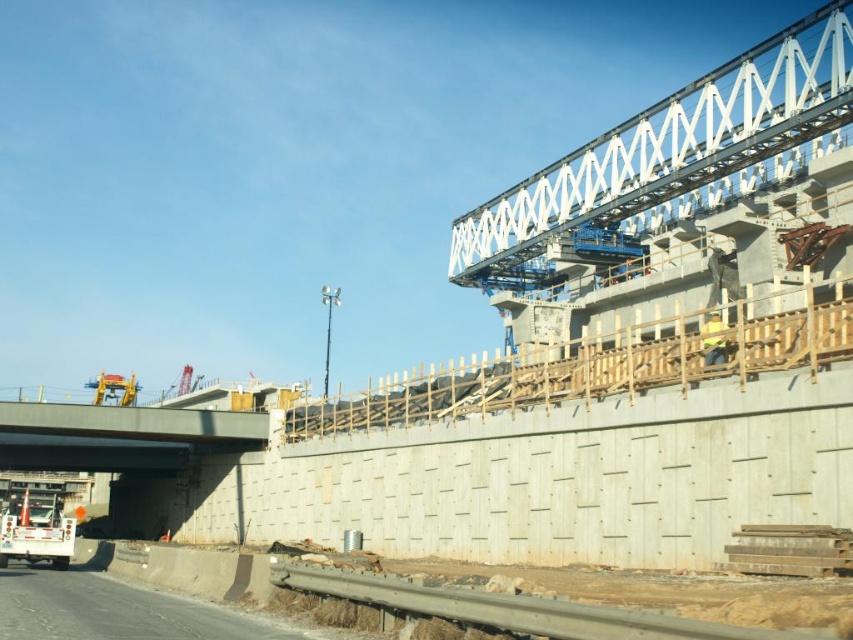
Does gray metallic overpass at left have a larger size compared to yellow reflective vest at center?

Correct, gray metallic overpass at left is larger in size than yellow reflective vest at center.

Find the location of `gray metallic overpass at left`. gray metallic overpass at left is located at coordinates (119, 435).

The width and height of the screenshot is (853, 640). Describe the element at coordinates (119, 435) in the screenshot. I see `gray metallic overpass at left` at that location.

What are the coordinates of `gray metallic overpass at left` in the screenshot? It's located at (119, 435).

Is gray metallic overpass at left thinner than gray concrete highway at lower left?

No, gray metallic overpass at left is not thinner than gray concrete highway at lower left.

The height and width of the screenshot is (640, 853). I want to click on gray metallic overpass at left, so click(x=119, y=435).

Does point (85, 417) come in front of point (90, 616)?

No, it is behind (90, 616).

Where is `gray metallic overpass at left`? Image resolution: width=853 pixels, height=640 pixels. gray metallic overpass at left is located at coordinates (119, 435).

What do you see at coordinates (112, 611) in the screenshot?
I see `gray concrete highway at lower left` at bounding box center [112, 611].

Who is positioned more to the left, gray concrete highway at lower left or yellow reflective vest at center?

gray concrete highway at lower left is more to the left.

Identify the location of gray concrete highway at lower left. Image resolution: width=853 pixels, height=640 pixels. (112, 611).